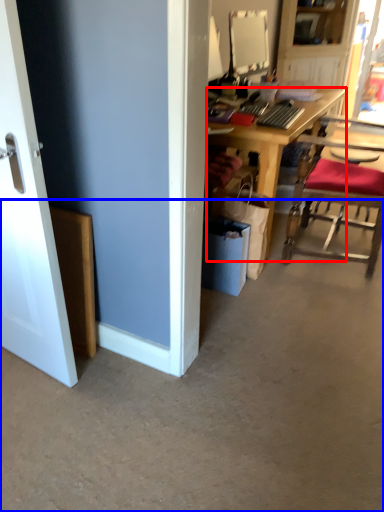
Question: Which point is closer to the camera, desk (highlighted by a red box) or concrete (highlighted by a blue box)?

Choices:
 (A) desk
 (B) concrete

Answer: (B)